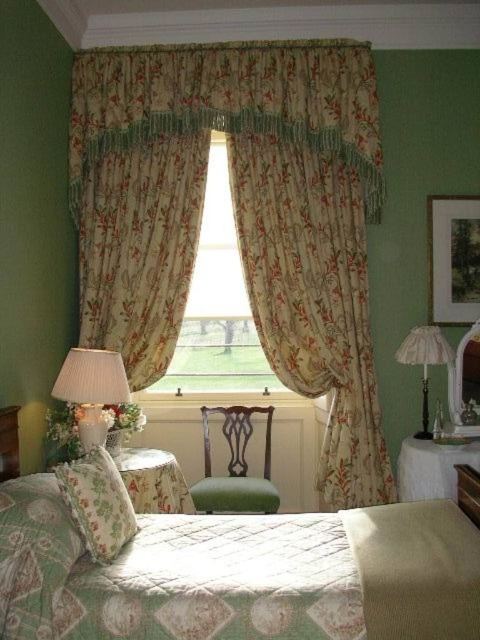
You are standing in the bedroom and want to take a photo of both point (84, 51) and point (420, 346) in the scene. Which point should you focus on first to ensure both are in focus?

You should focus on point (84, 51) first because it is closer to the camera than point (420, 346). By focusing on the closer point, the farther point will also be in focus due to the depth of field.

You are a decorator planning to hang a new picture frame between the floral fabric curtains at center and the white fabric lampshade at right. Based on their positions, where should you place the frame?

The floral fabric curtains at center are above the white fabric lampshade at right, so you should place the picture frame below the floral fabric curtains at center and above the white fabric lampshade at right to position it between them.